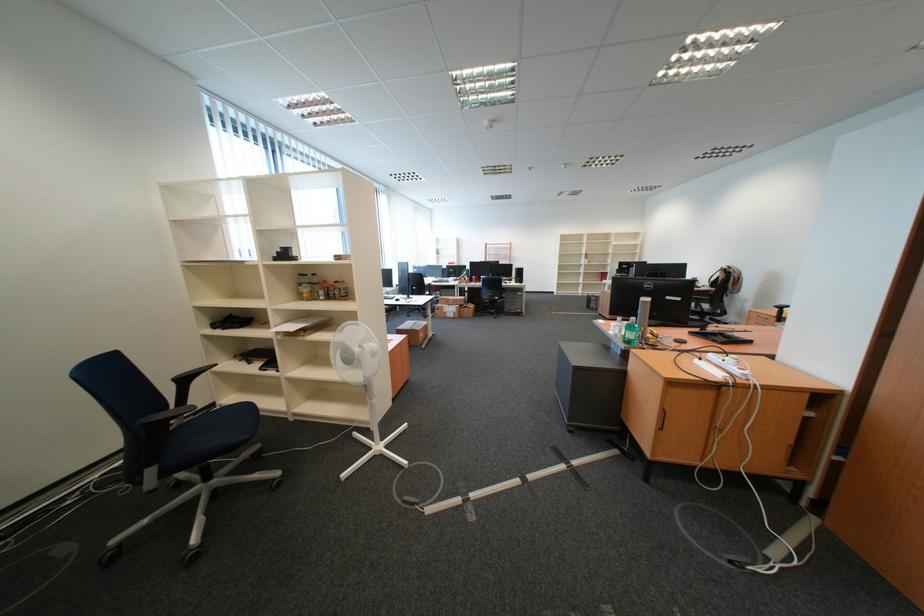
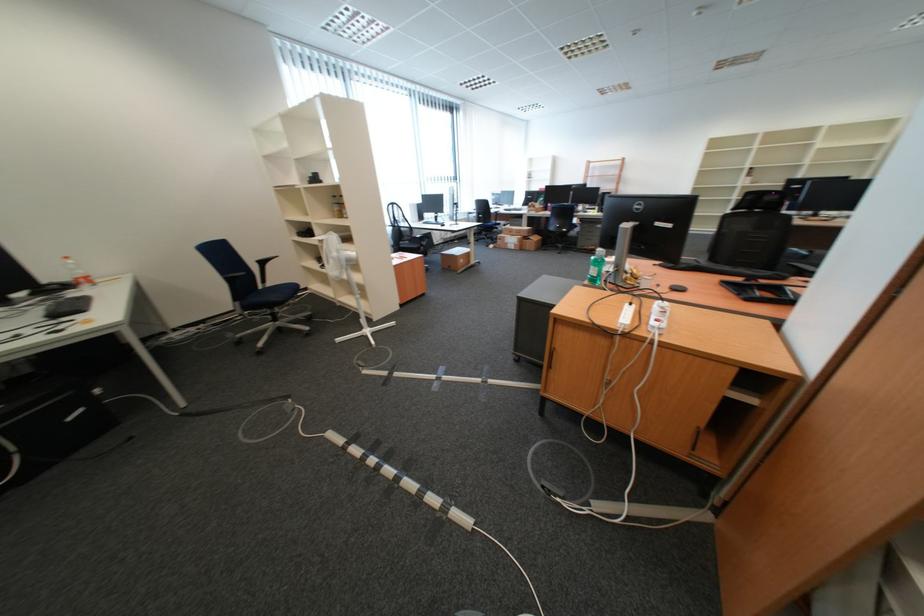
In the second image, find the point that corresponds to point (464, 317) in the first image.

(525, 249)